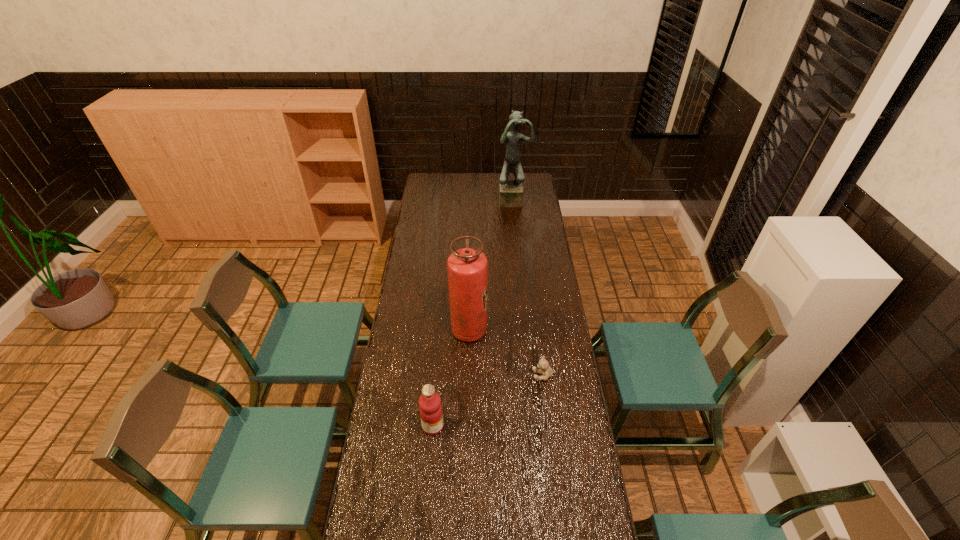
At what (x,y) coordinates should I click in order to perform the action: click on sculpture. Please return your answer as a coordinate pair (x, y). The width and height of the screenshot is (960, 540). Looking at the image, I should click on (510, 191).

The width and height of the screenshot is (960, 540). Identify the location of the third nearest object. (467, 268).

Locate an element on the screen. The height and width of the screenshot is (540, 960). fire extinguisher is located at coordinates (467, 268).

Where is `the second shortest object`? This screenshot has height=540, width=960. the second shortest object is located at coordinates (431, 413).

Where is `fruit juice`? fruit juice is located at coordinates (431, 413).

Where is `the second nearest object`? the second nearest object is located at coordinates (543, 365).

At what (x,y) coordinates should I click in order to perform the action: click on the shortest object. Please return your answer as a coordinate pair (x, y). Image resolution: width=960 pixels, height=540 pixels. Looking at the image, I should click on (543, 365).

Identify the location of blank area located on the face of the sculpture. The image size is (960, 540). (516, 221).

Find the location of a particular element. The width and height of the screenshot is (960, 540). free location located 0.300m on the label side of the second object from left to right is located at coordinates (555, 330).

What are the coordinates of `free location located on the label of the third tallest object` in the screenshot? It's located at (537, 426).